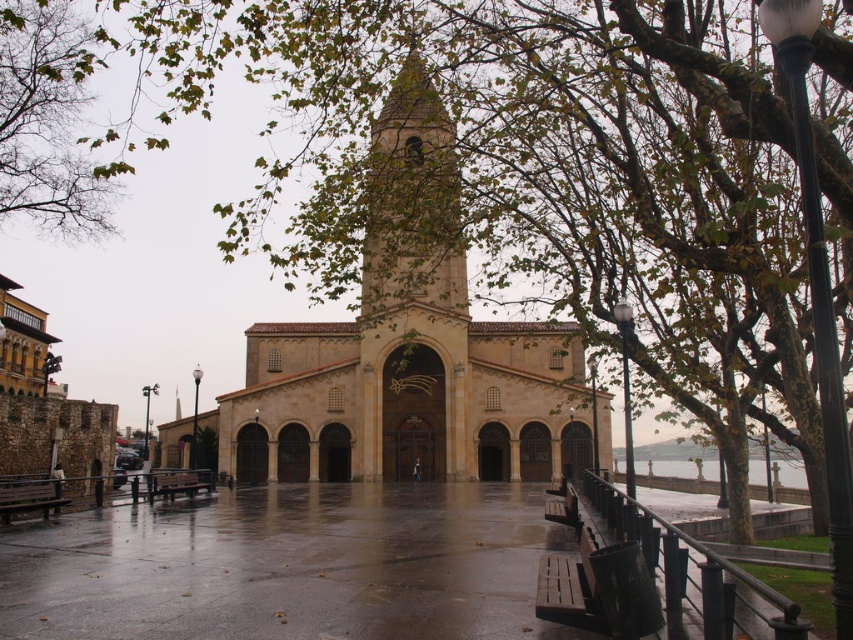
Question: Based on their relative distances, which object is farther from the wooden park bench at lower right?

Choices:
 (A) green leafy branches at upper left
 (B) brown wooden bench at lower left
 (C) beige stone church at center

Answer: (A)

Question: Which point is farther to the camera?

Choices:
 (A) green leafy branches at upper left
 (B) brown wooden bench at lower left
 (C) wooden park bench at lower right

Answer: (B)

Question: Does green leafy branches at upper left appear under wooden park bench at lower right?

Choices:
 (A) no
 (B) yes

Answer: (A)

Question: From the image, what is the correct spatial relationship of green leafy branches at upper left in relation to wooden bench at lower left?

Choices:
 (A) above
 (B) below

Answer: (A)

Question: Can you confirm if beige stone church at center is wider than wooden bench at lower left?

Choices:
 (A) no
 (B) yes

Answer: (B)

Question: Which of the following is the closest to the observer?

Choices:
 (A) (39, 508)
 (B) (552, 556)
 (C) (90, 172)
 (D) (473, 392)

Answer: (B)